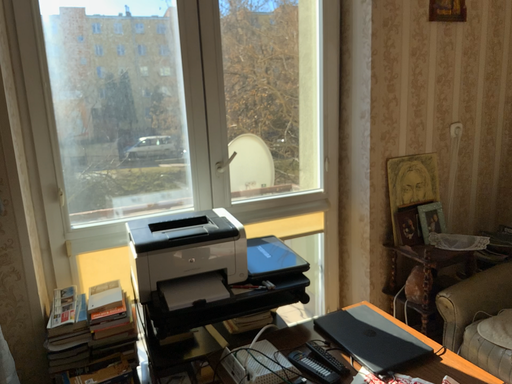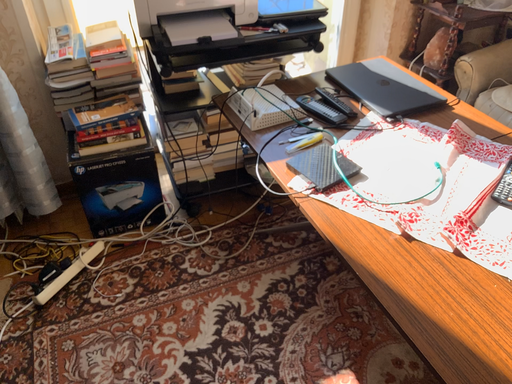
Question: Which way did the camera rotate in the video?

Choices:
 (A) rotated downward
 (B) rotated upward

Answer: (A)